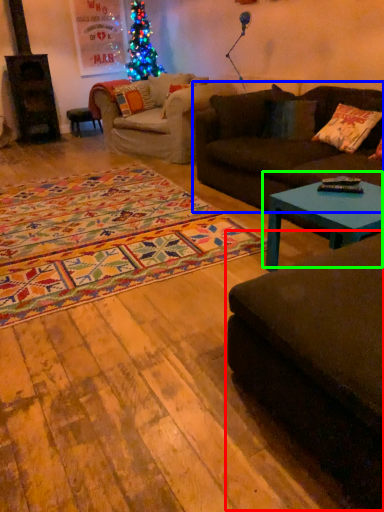
Question: Which object is positioned farthest from studio couch (highlighted by a red box)? Select from studio couch (highlighted by a blue box) and coffee table (highlighted by a green box).

Choices:
 (A) studio couch
 (B) coffee table

Answer: (A)